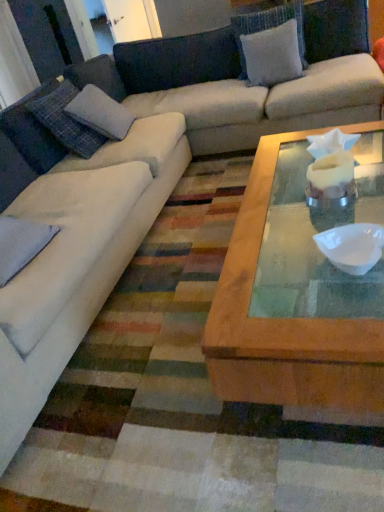
Question: Is white fabric pillow at upper center, which ranks as the 1th pillow in back-to-front order, taller or shorter than gray fabric pillow at left, which is the 1th pillow from front to back?

Choices:
 (A) short
 (B) tall

Answer: (B)

Question: Is white fabric pillow at upper center, marked as the 3th pillow in a left-to-right arrangement, inside or outside of gray fabric pillow at left, positioned as the second pillow in left-to-right order?

Choices:
 (A) outside
 (B) inside

Answer: (A)

Question: Which object is the farthest from the white fabric pillow at upper center, acting as the first pillow starting from the right?

Choices:
 (A) gray fabric pillow at left, acting as the 3th pillow starting from the back
 (B) white matte bowl at center
 (C) plaid fabric pillow at left, acting as the second pillow starting from the top

Answer: (B)

Question: Which of these objects is positioned farthest from the white matte bowl at center?

Choices:
 (A) white fabric pillow at upper center, marked as the 3th pillow in a left-to-right arrangement
 (B) plaid fabric pillow at left, arranged as the 2th pillow when viewed from the front
 (C) gray fabric pillow at left, acting as the 3th pillow starting from the back

Answer: (A)